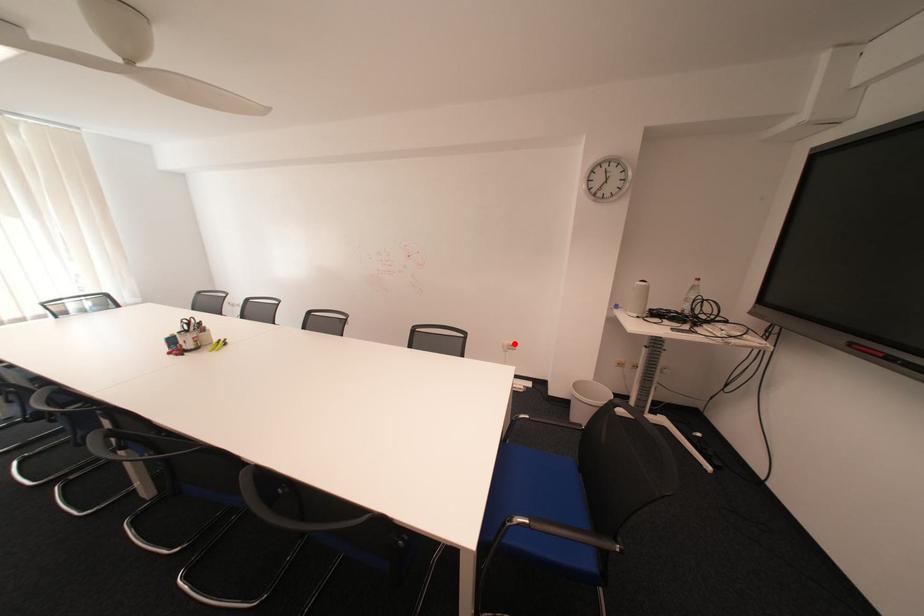
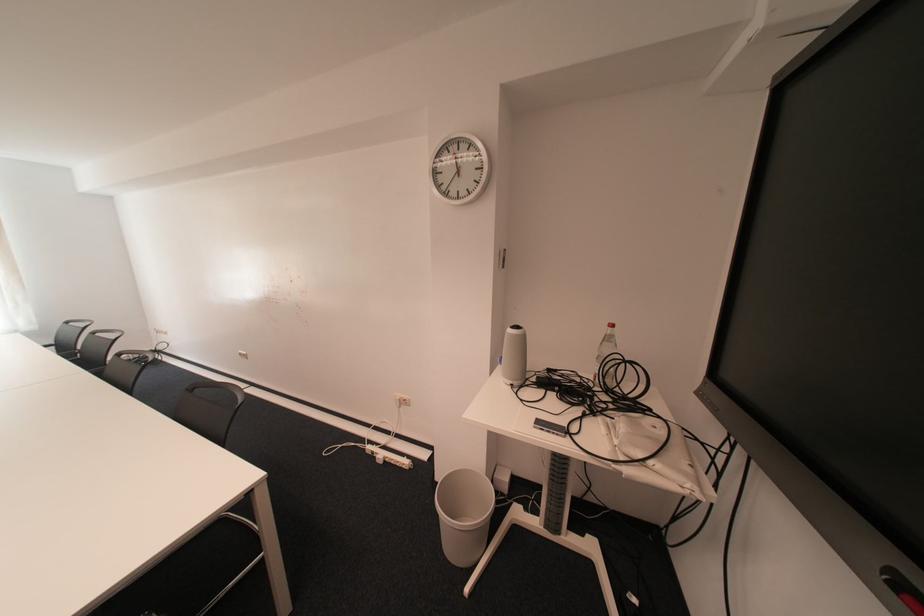
The point at the highlighted location is marked in the first image. Where is the corresponding point in the second image?

(407, 397)